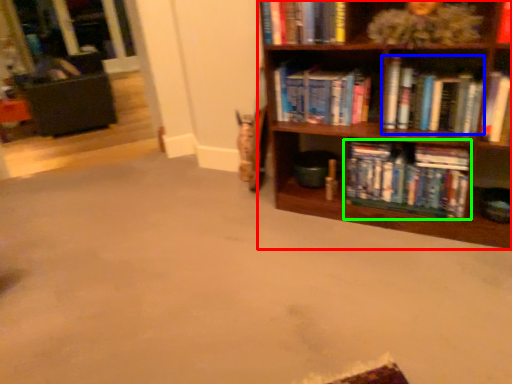
Question: Estimate the real-world distances between objects in this image. Which object is closer to bookcase (highlighted by a red box), book (highlighted by a blue box) or book (highlighted by a green box)?

Choices:
 (A) book
 (B) book

Answer: (B)